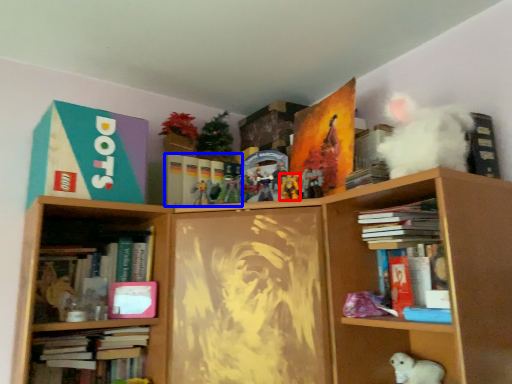
Question: Which object appears closest to the camera in this image, toy (highlighted by a red box) or book (highlighted by a blue box)?

Choices:
 (A) toy
 (B) book

Answer: (A)